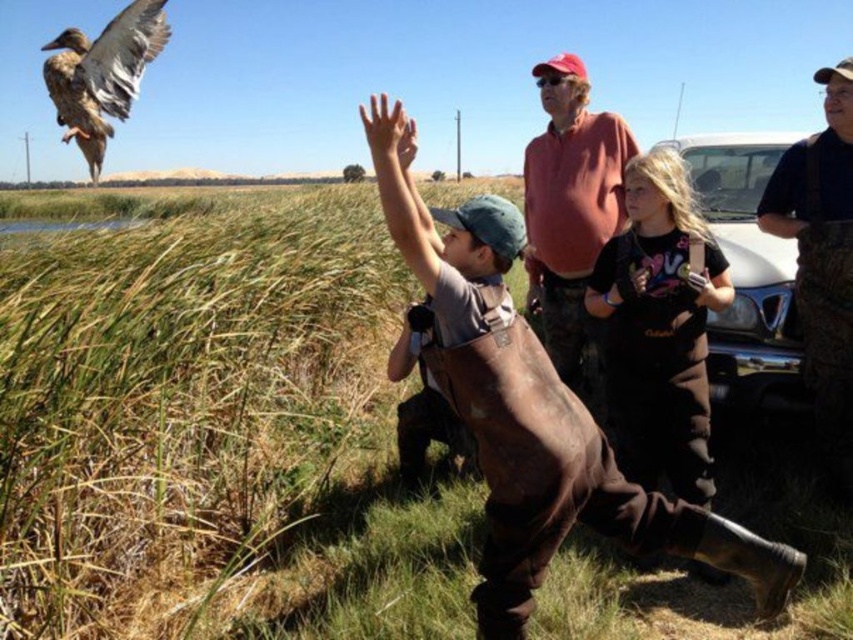
You are a tailor trying to fit clothes for two children. You have a brown leather overalls at center and a black cotton shirt at center. Which clothing item requires more fabric to make?

The brown leather overalls at center requires more fabric to make because it has a larger size compared to the black cotton shirt at center.

You are a parent at the wetland and see the brown leather overalls at center and the brown camo overalls at right. Which pair of overalls is larger?

The brown leather overalls at center is bigger than the brown camo overalls at right.

You are a photographer trying to capture a clear photo of the brown leather overalls at center and the brown feathered duck at upper left. Which object should you focus on first to ensure both are in focus?

You should focus on the brown leather overalls at center first because it is closer to you than the brown feathered duck at upper left, so focusing on it will help ensure both are in focus.